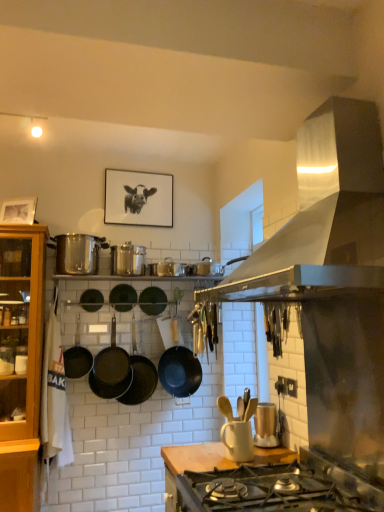
Question: Considering the positions of satin silver range hood at upper right and black matte wok at center, the seventh wok when ordered from left to right, in the image, is satin silver range hood at upper right wider or thinner than black matte wok at center, the seventh wok when ordered from left to right,?

Choices:
 (A) wide
 (B) thin

Answer: (A)

Question: In the image, is satin silver range hood at upper right on the left side or the right side of black matte wok at center, which is the 1th wok in right-to-left order?

Choices:
 (A) left
 (B) right

Answer: (B)

Question: Based on their relative distances, which object is nearer to the black matte wok at center, arranged as the second wok when viewed from the left?

Choices:
 (A) black matte picture frame at upper center
 (B) satin silver range hood at upper right
 (C) shiny metallic canisters at center, the second appliance ordered from the bottom
 (D) black matte wok at center, the 7th wok when ordered from right to left
 (E) green matte wok at center, the fourth wok in the left-to-right sequence

Answer: (E)

Question: Which object is positioned closest to the wooden at center?

Choices:
 (A) matte gold toaster at center, the second appliance viewed from the top
 (B) black matte picture frame at upper center
 (C) black matte wok at center, the 6th wok positioned from the right
 (D) shiny silver pot at left
 (E) shiny metallic canisters at center, positioned as the 2th appliance in front-to-back order

Answer: (A)